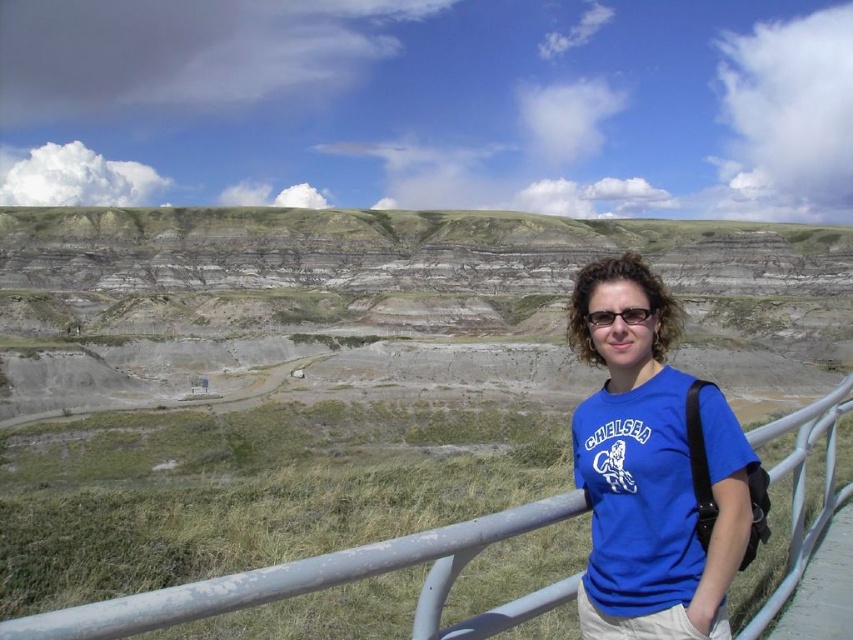
Which is in front, point (723, 467) or point (613, 314)?

Point (723, 467) is in front.

Does blue cotton shirt at center have a smaller size compared to black plastic glasses at center?

Incorrect, blue cotton shirt at center is not smaller in size than black plastic glasses at center.

Which is in front, point (730, 508) or point (627, 323)?

Point (730, 508) is more forward.

Image resolution: width=853 pixels, height=640 pixels. I want to click on blue cotton shirt at center, so click(x=654, y=472).

Is white matte rail at center closer to the viewer compared to black plastic glasses at center?

Yes.

Who is positioned more to the right, white matte rail at center or black plastic glasses at center?

black plastic glasses at center

Find the location of a particular element. This screenshot has width=853, height=640. white matte rail at center is located at coordinates [x=329, y=582].

Where is `white matte rail at center`? white matte rail at center is located at coordinates (329, 582).

Is point (648, 346) positioned in front of point (850, 410)?

That is True.

Does blue cotton shirt at center appear over white matte rail at center?

Yes.

Describe the element at coordinates (654, 472) in the screenshot. This screenshot has height=640, width=853. I see `blue cotton shirt at center` at that location.

The image size is (853, 640). In order to click on blue cotton shirt at center in this screenshot , I will do `click(654, 472)`.